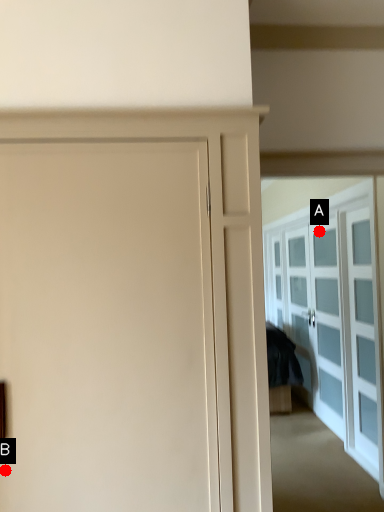
Question: Two points are circled on the image, labeled by A and B beside each circle. Which point is farther from the camera taking this photo?

Choices:
 (A) A is further
 (B) B is further

Answer: (A)